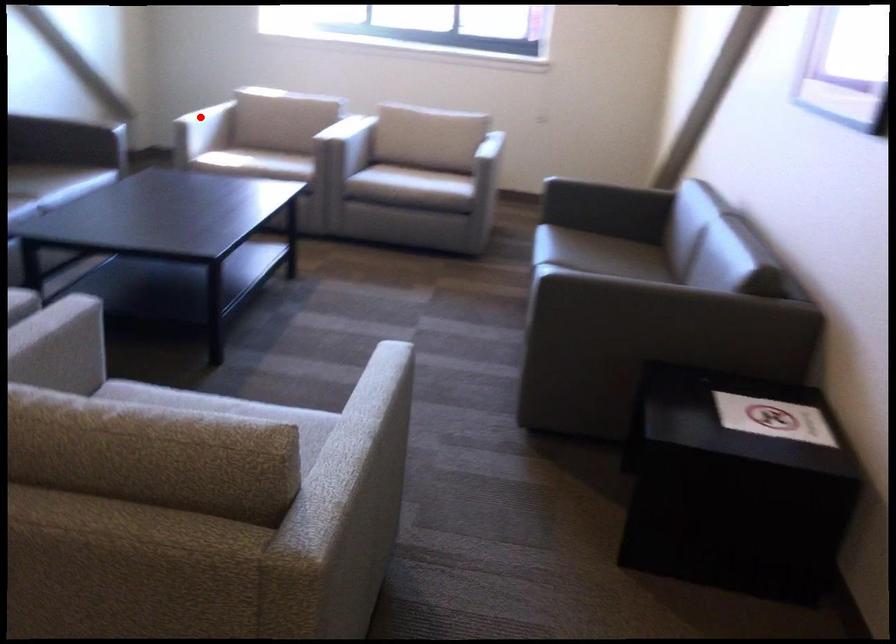
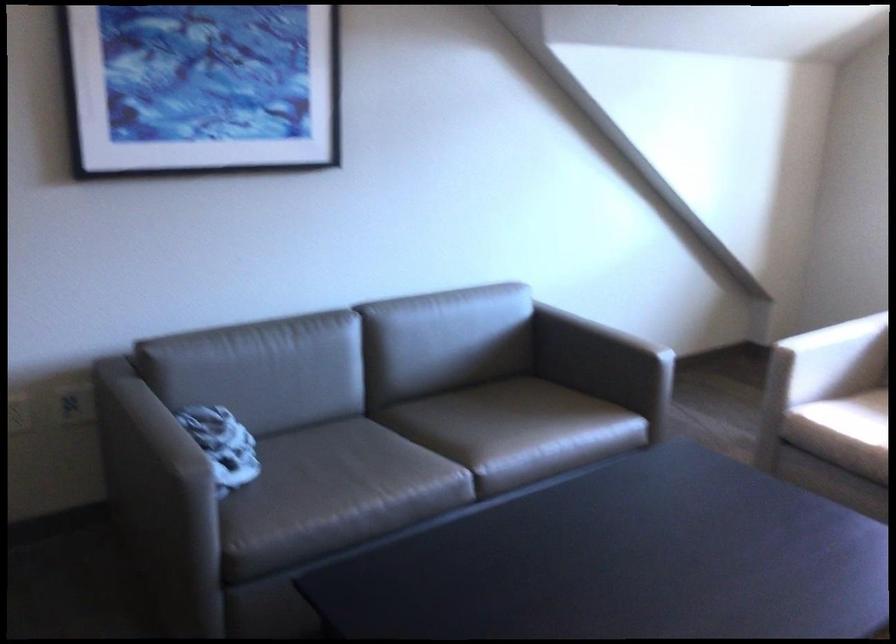
In the second image, find the point that corresponds to the highlighted location in the first image.

(831, 359)